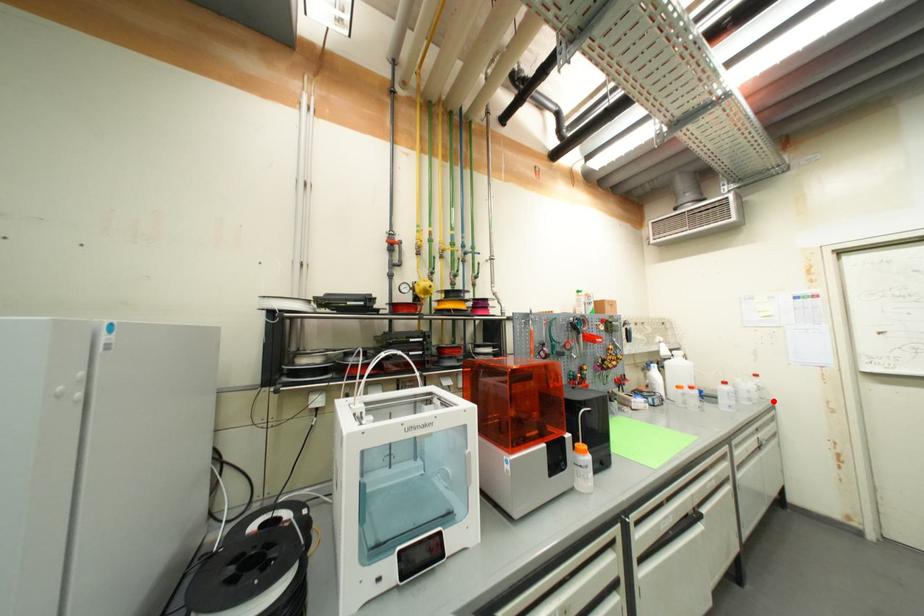
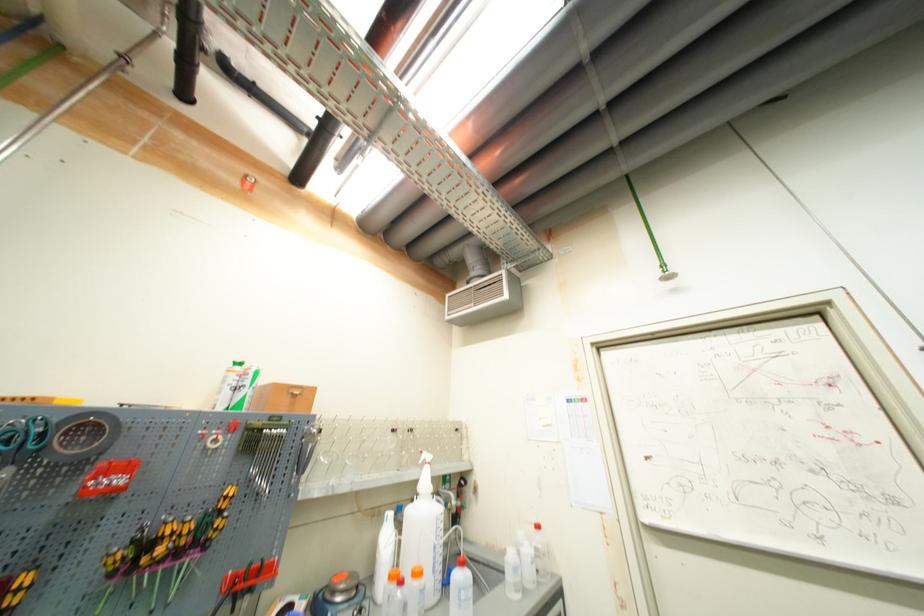
Find the pixel in the second image that matches the highlighted location in the first image.

(558, 578)